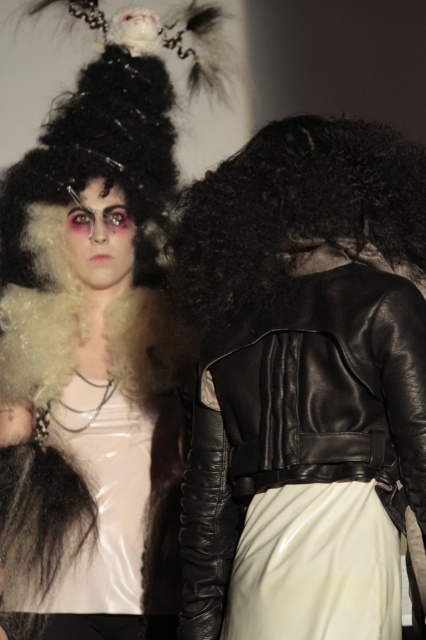
You are a photographer setting up a shoot in the described scene. You need to position a spotlight exactly at point (x=296, y=212). Which object from the scene will this spotlight illuminate?

The spotlight at point (x=296, y=212) will illuminate the black curly wig at back.

You are a photographer setting up for a photoshoot. You have two points marked in the scene, point 1 at coordinates point (408, 141) and point 2 at coordinates point (127, 490). You need to place a spotlight that can only illuminate objects closer to the camera. Which point should you aim the spotlight at?

Point (408, 141) is closer to the camera than point (127, 490), so you should aim the spotlight at point (408, 141) to illuminate the closer object.

You are a photographer setting up a shoot. You need to ensure that the black curly wig at back does not cover the white glossy dress at center in the final image. Based on their current positions, is this achievable?

The black curly wig at back is positioned over the white glossy dress at center, so adjusting the angle or having the model move slightly could help reveal more of the dress while minimizing the wig covering it.